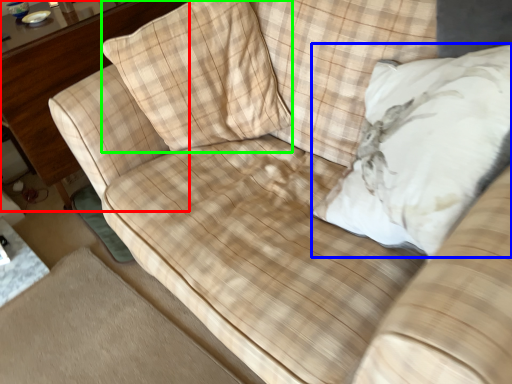
Question: Estimate the real-world distances between objects in this image. Which object is closer to dresser (highlighted by a red box), throw pillow (highlighted by a blue box) or throw pillow (highlighted by a green box)?

Choices:
 (A) throw pillow
 (B) throw pillow

Answer: (B)